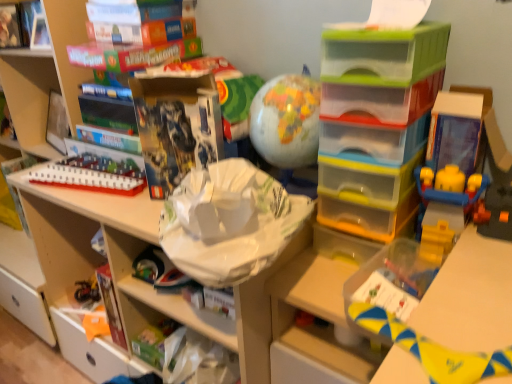
Question: Is yellow fabric toy at lower right, which ranks as the 3th toy in left-to-right order, bigger or smaller than white cardboard shelf at upper left, the 1th shelf in the left-to-right sequence?

Choices:
 (A) big
 (B) small

Answer: (B)

Question: Do you think yellow fabric toy at lower right, which is the 1th toy from right to left, is within white cardboard shelf at upper left, the 1th shelf in the left-to-right sequence, or outside of it?

Choices:
 (A) outside
 (B) inside

Answer: (A)

Question: Which of these objects is positioned farthest from the hardcover book at upper left, marked as the second book in a left-to-right arrangement?

Choices:
 (A) matte black book at upper center, acting as the fifth book starting from the left
 (B) white plastic bookshelf at left
 (C) white cardboard shelf at upper left, acting as the 2th shelf starting from the right
 (D) white paper bag at upper center, the 2th book positioned from the right
 (E) white plastic train at upper left, which is counted as the 1th toy, starting from the back

Answer: (D)

Question: Estimate the real-world distances between objects in this image. Which object is farther from the matte black book at upper center, acting as the fifth book starting from the left?

Choices:
 (A) matte plastic globe at center, the 2th toy in the front-to-back sequence
 (B) white plastic train at upper left, which ranks as the third toy in right-to-left order
 (C) translucent plastic drawers at center, which is the first shelf from right to left
 (D) white paper bag at upper center, which appears as the fourth book when viewed from the left
 (E) white plastic bookshelf at left

Answer: (E)